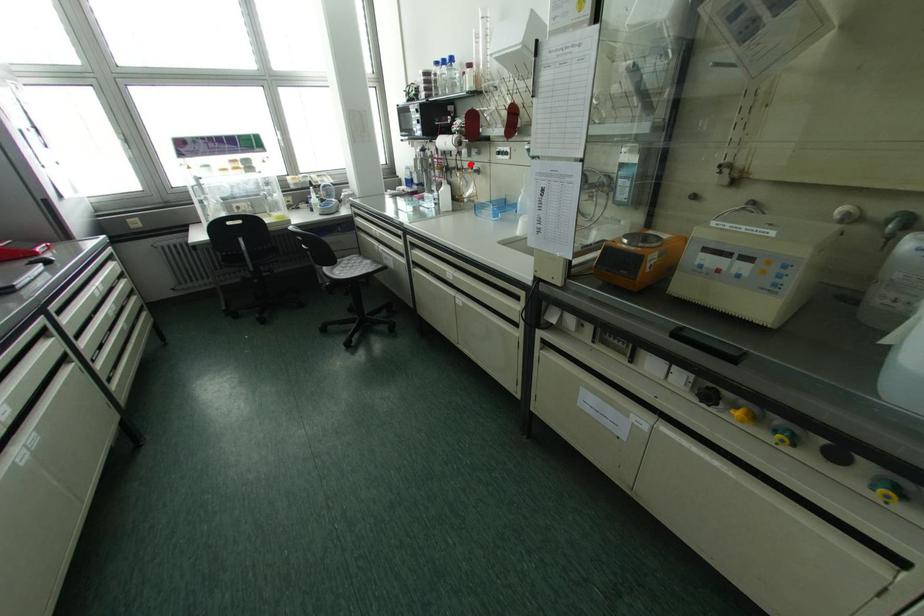
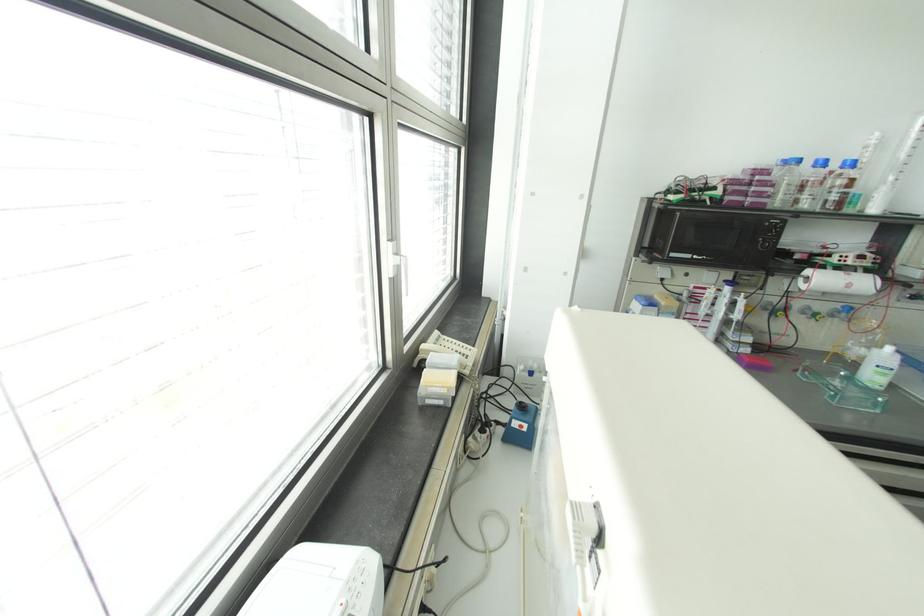
Question: I am providing you with two images of the same scene from different viewpoints. Image1 has a red point marked. In image2, the corresponding 3D location appears at what relative position? Reply with the corresponding letter.

Choices:
 (A) Closer
 (B) Farther

Answer: (B)